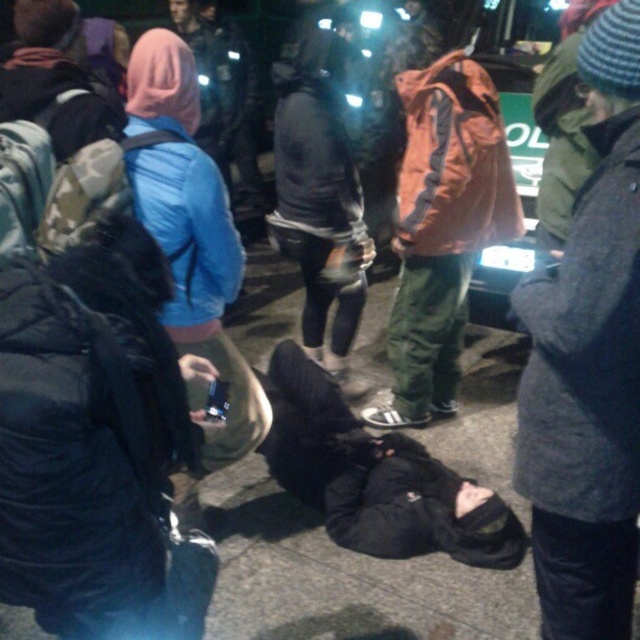
You are a photographer standing at the scene. You want to take a photo of the orange fabric jacket at center and the blue fabric jacket at upper left in the same frame. Given that your camera has a maximum focus range of 2 meters, will both jackets be in focus?

The orange fabric jacket at center is 1.89 meters away from blue fabric jacket at upper left. Since the distance between them is within the camera maximum focus range of 2 meters, both jackets will be in focus.

You are standing at the point labeled as point (474, 138) in the image. You want to take a photo of the person lying on the ground who is 3 meters away from you. Can you step back to a position where you can still capture the entire scene without moving your camera angle? Explain your reasoning.

The point labeled (474, 138) is 2.60 meters away from the viewer. If the person lying on the ground is 3 meters away from you, stepping back would increase your distance from the person. However, since the original distance is already 2.60 meters, stepping back to 3 meters would require moving 0.40 meters away. This adjustment might allow you to capture the entire scene without changing the camera angle, provided there are no obstructions in the new position.

You are a photographer trying to capture a clear shot of the person lying on the ground in the nighttime scene. You notice two jackets in the frame, the orange fabric jacket at center and the blue fabric jacket at upper left. Which jacket is taller in the image?

The orange fabric jacket at center is taller than the blue fabric jacket at upper left.